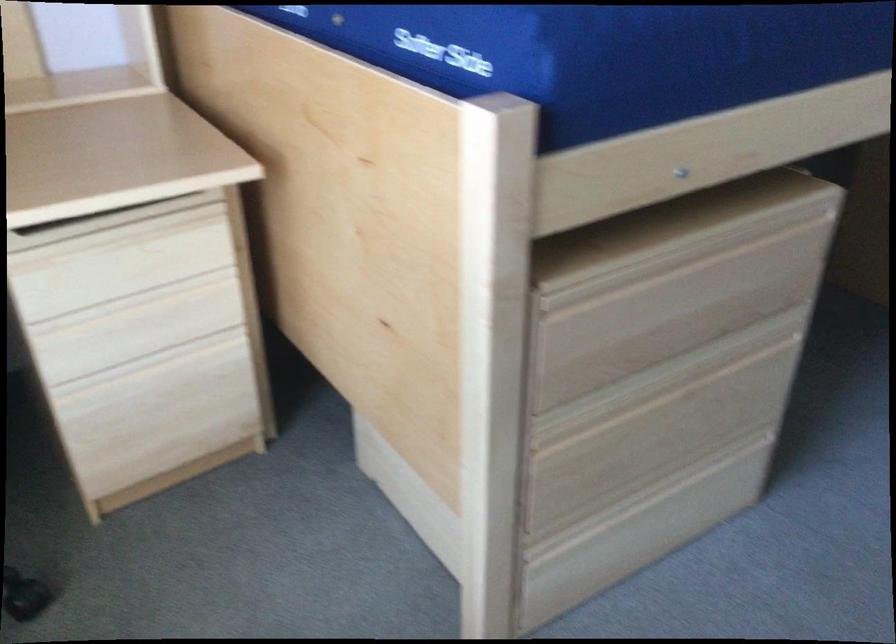
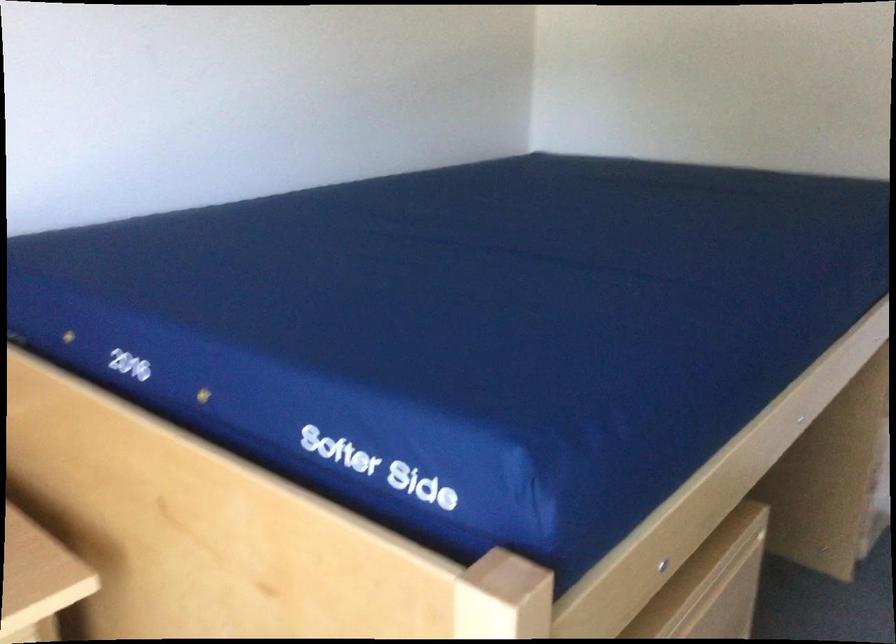
Question: The camera is either moving clockwise (left) or counter-clockwise (right) around the object. The first image is from the beginning of the video and the second image is from the end. Is the camera moving left or right when shooting the video?

Choices:
 (A) Left
 (B) Right

Answer: (A)